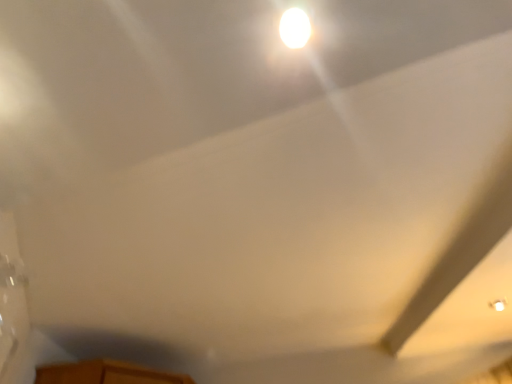
Question: Should I look upward or downward to see white glossy light bulb at upper center?

Choices:
 (A) up
 (B) down

Answer: (A)

Question: Would you say white glossy light bulb at upper center contains white matte exhaust hood at upper right?

Choices:
 (A) no
 (B) yes

Answer: (A)

Question: From a real-world perspective, is white glossy light bulb at upper center below white matte exhaust hood at upper right?

Choices:
 (A) no
 (B) yes

Answer: (B)

Question: Is white glossy light bulb at upper center at the left side of white matte exhaust hood at upper right?

Choices:
 (A) yes
 (B) no

Answer: (A)

Question: Considering the relative positions of white glossy light bulb at upper center and white matte exhaust hood at upper right in the image provided, is white glossy light bulb at upper center to the right of white matte exhaust hood at upper right from the viewer's perspective?

Choices:
 (A) no
 (B) yes

Answer: (A)

Question: From the image's perspective, would you say white glossy light bulb at upper center is shown under white matte exhaust hood at upper right?

Choices:
 (A) no
 (B) yes

Answer: (A)

Question: Is white glossy light bulb at upper center shorter than white matte exhaust hood at upper right?

Choices:
 (A) yes
 (B) no

Answer: (A)

Question: Is white matte exhaust hood at upper right placed right next to white glossy light bulb at upper center?

Choices:
 (A) yes
 (B) no

Answer: (B)

Question: From a real-world perspective, is white matte exhaust hood at upper right physically above white glossy light bulb at upper center?

Choices:
 (A) no
 (B) yes

Answer: (B)

Question: Is white matte exhaust hood at upper right aimed at white glossy light bulb at upper center?

Choices:
 (A) yes
 (B) no

Answer: (B)

Question: From the image's perspective, is white matte exhaust hood at upper right located above white glossy light bulb at upper center?

Choices:
 (A) no
 (B) yes

Answer: (A)

Question: Is white glossy light bulb at upper center inside white matte exhaust hood at upper right?

Choices:
 (A) no
 (B) yes

Answer: (A)

Question: Is white matte exhaust hood at upper right closer to the viewer compared to white glossy light bulb at upper center?

Choices:
 (A) no
 (B) yes

Answer: (A)

Question: Is white matte exhaust hood at upper right inside or outside of white glossy light bulb at upper center?

Choices:
 (A) inside
 (B) outside

Answer: (B)